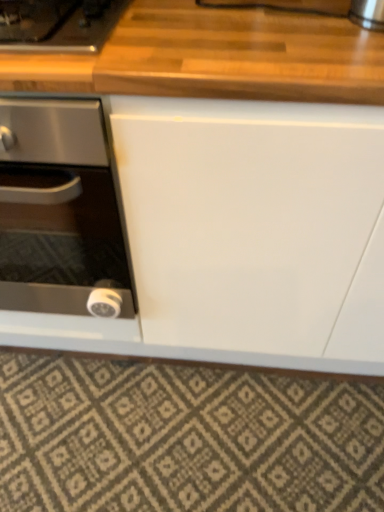
Question: Considering their positions, is wooden gas stove at upper left located in front of or behind textured beige rug at lower center?

Choices:
 (A) behind
 (B) front

Answer: (B)

Question: From a real-world perspective, is wooden gas stove at upper left positioned above or below textured beige rug at lower center?

Choices:
 (A) above
 (B) below

Answer: (A)

Question: Which is nearer to the textured beige rug at lower center?

Choices:
 (A) black glass stove at left
 (B) wooden gas stove at upper left

Answer: (A)

Question: Considering the real-world distances, which object is farthest from the wooden gas stove at upper left?

Choices:
 (A) textured beige rug at lower center
 (B) black glass stove at left

Answer: (A)